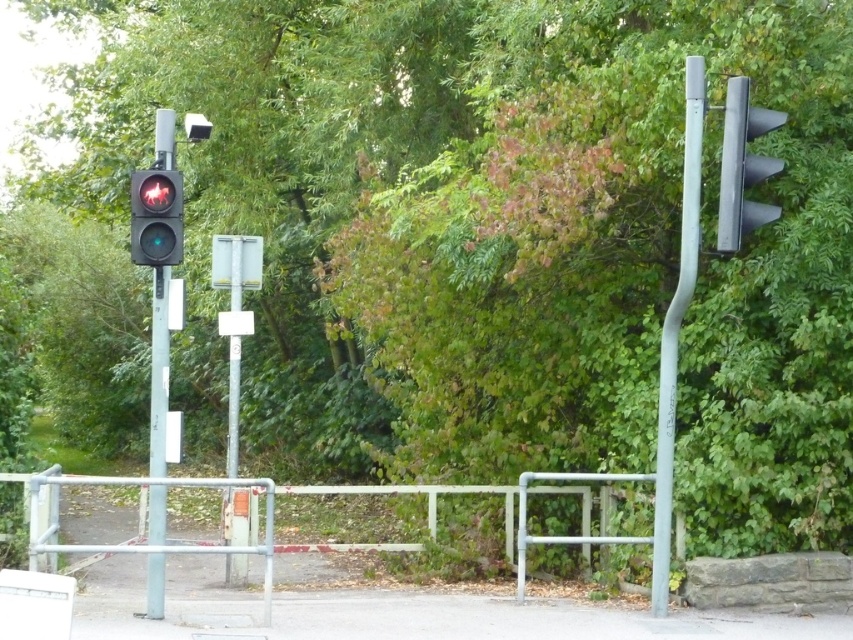
Question: Which point is farther to the camera?

Choices:
 (A) (668, 401)
 (B) (160, 582)
 (C) (236, 320)
 (D) (140, 184)

Answer: (C)

Question: Among these points, which one is nearest to the camera?

Choices:
 (A) (165, 224)
 (B) (160, 508)

Answer: (A)

Question: Does metallic gray traffic light at right appear on the right side of white plastic sign at center?

Choices:
 (A) yes
 (B) no

Answer: (A)

Question: Based on their relative distances, which object is farther from the metallic gray sign at center?

Choices:
 (A) white plastic sign at center
 (B) metallic gray pole at right

Answer: (B)

Question: Is metallic pole at left above matte glass traffic light at left?

Choices:
 (A) yes
 (B) no

Answer: (B)

Question: Does matte glass traffic light at left appear on the right side of metallic pole at center?

Choices:
 (A) no
 (B) yes

Answer: (A)